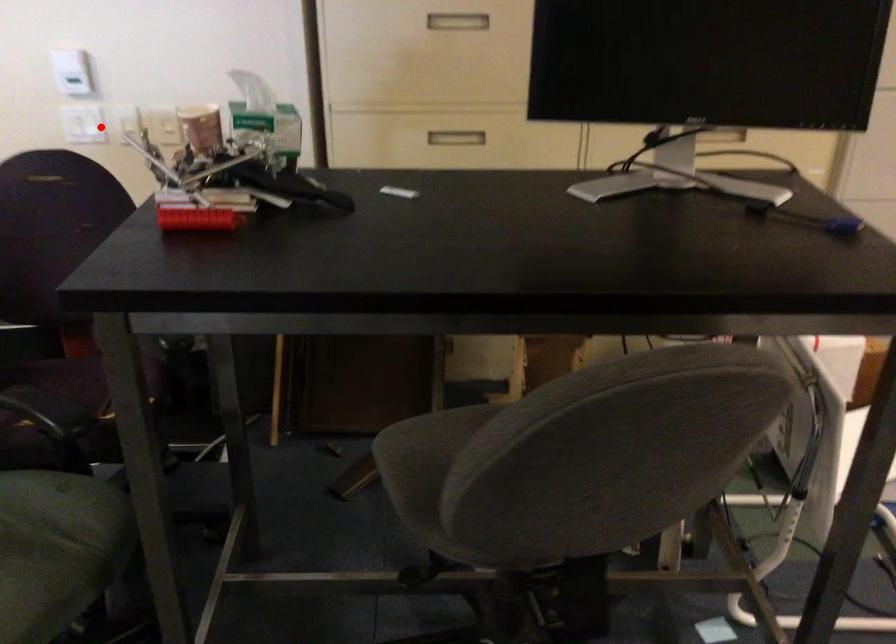
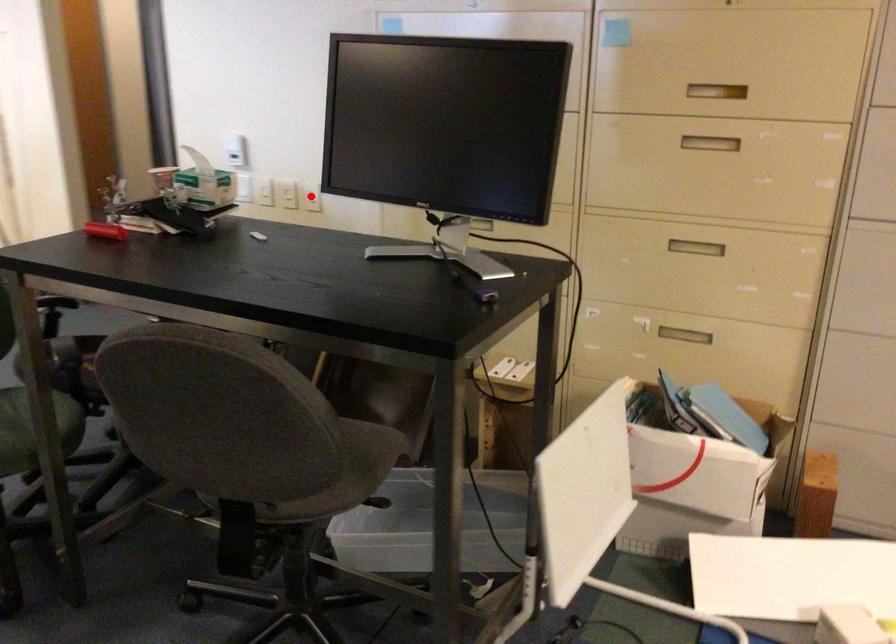
I am providing you with two images of the same scene from different viewpoints. A red point is marked on the first image and another point is marked on the second image. Is the marked point in image1 the same physical position as the marked point in image2?

No